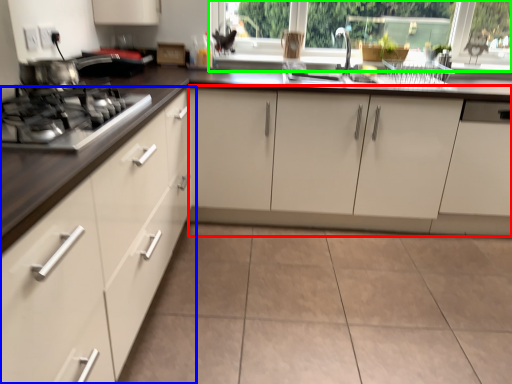
Question: Which is farther away from cabinetry (highlighted by a red box)? cabinetry (highlighted by a blue box) or window frame (highlighted by a green box)?

Choices:
 (A) cabinetry
 (B) window frame

Answer: (A)